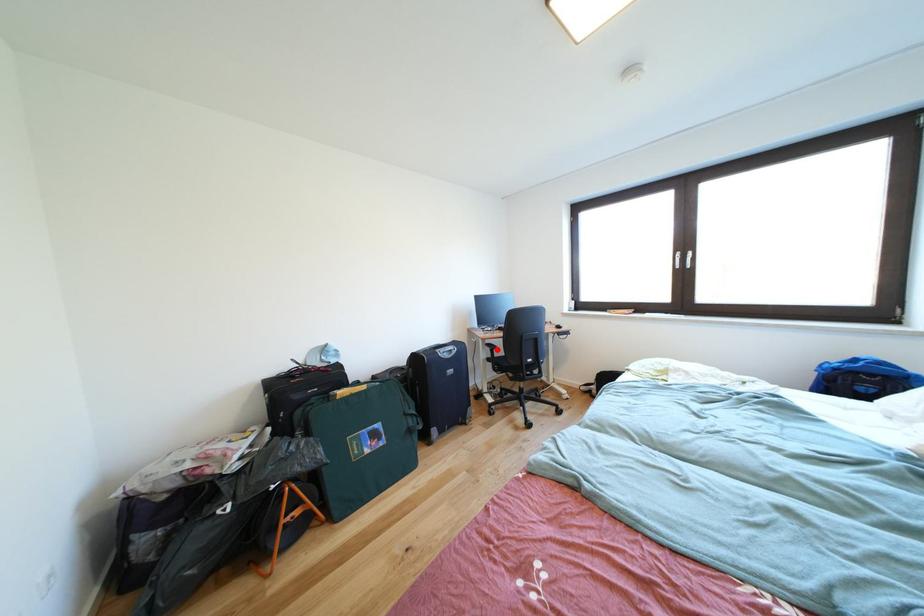
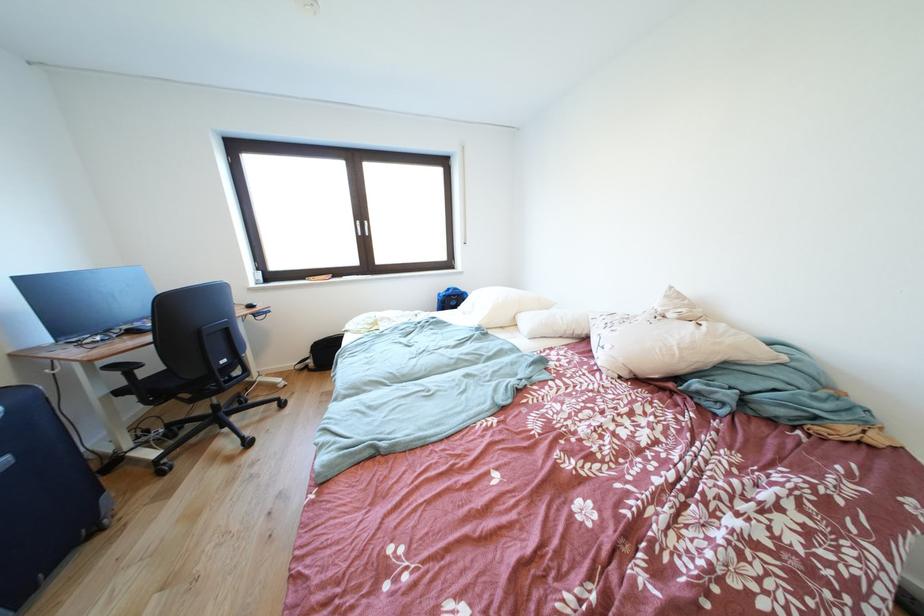
Find the pixel in the second image that matches the highlighted location in the first image.

(120, 371)